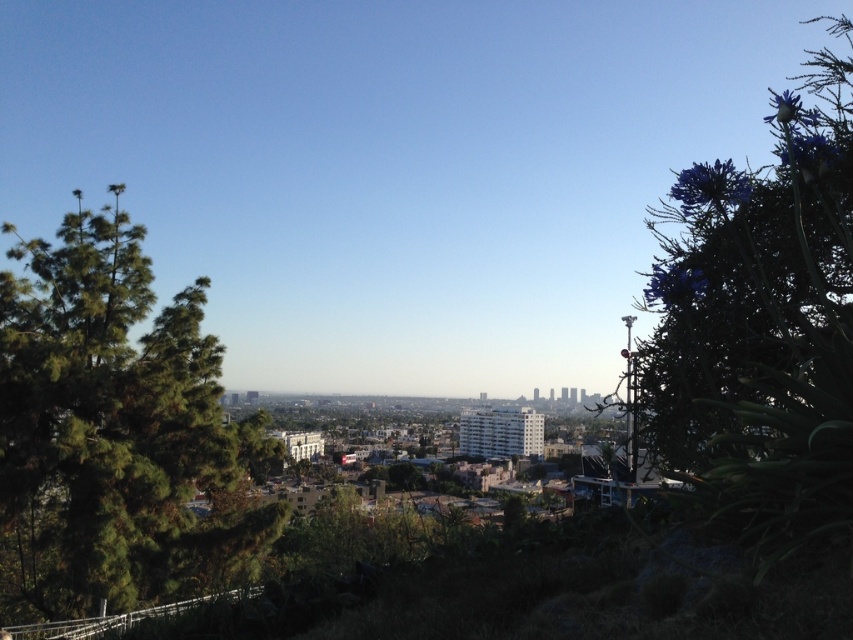
You are a landscape architect designing a garden path that needs to pass between the green leafy tree at left and the purple leafy plant at right. Given their sizes, which one might require more space to accommodate its spread?

The purple leafy plant at right requires more space because it occupies more area than the green leafy tree at left according to the description.

You are a landscape architect designing a garden path that needs to pass between the green leafy tree at left and the purple leafy plant at right. If the path must be 2 meters wide, can it fit between them based on their heights?

The green leafy tree at left is shorter than the purple leafy plant at right, but the question is about the width of the path, not the height of the plants. The provided information does not include the distance between them, so we cannot determine if the 2 meter wide path can fit.